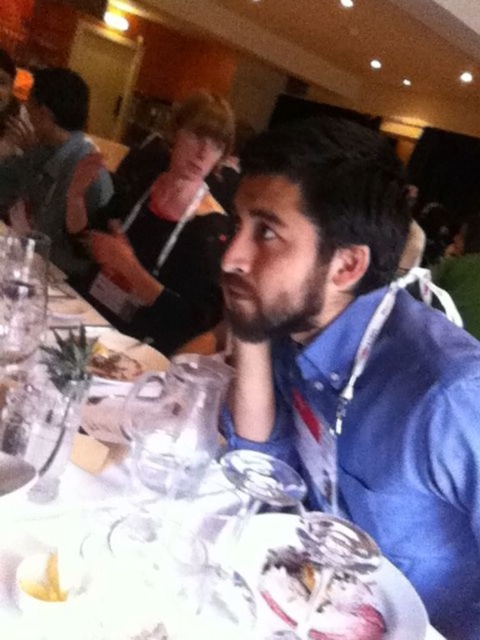
In the image of the social gathering, there is a blue fabric shirt at center and a yellow crispy potato at lower left. From the perspective of someone standing at the front of the image, which object is positioned to the left?

The blue fabric shirt at center is positioned to the left of the yellow crispy potato at lower left.

You are standing in the banquet hall and notice two items on the table in front of you. The matte black shirt at upper left and the yellow crispy potato at lower left. Which item is positioned higher up on the table?

The matte black shirt at upper left is taller than the yellow crispy potato at lower left, so it is positioned higher up on the table.

You are standing at point (39,582) and want to walk to the exit located at point (192,230). Given the layout of the banquet hall, will you have to walk towards or away from the main entrance which is at the front of the room?

Point (192,230) is behind point (39,582), so walking to the exit at point (192,230) means you will be moving away from the main entrance located at the front of the room.